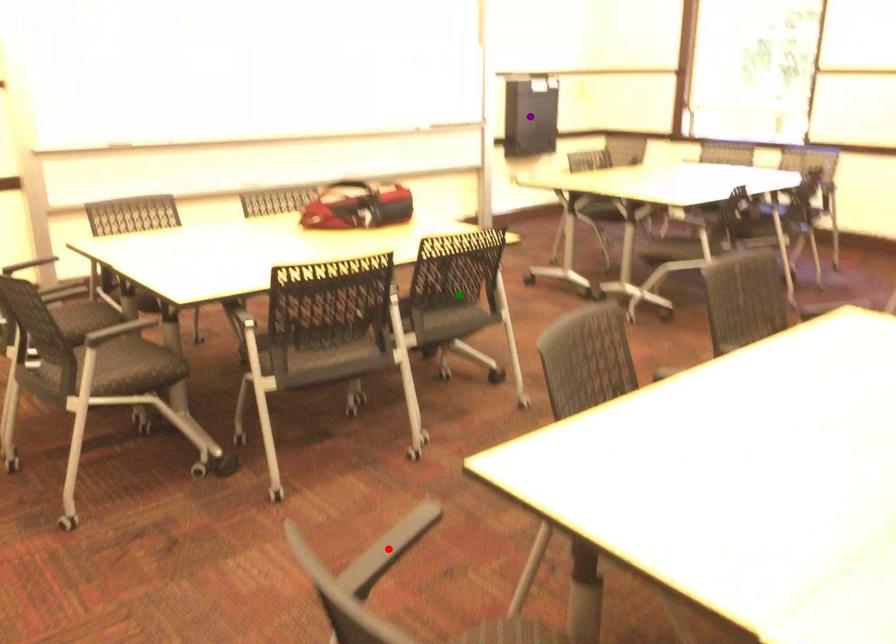
Based on the photo, order these from nearest to farthest:
red point
purple point
green point

red point, green point, purple point